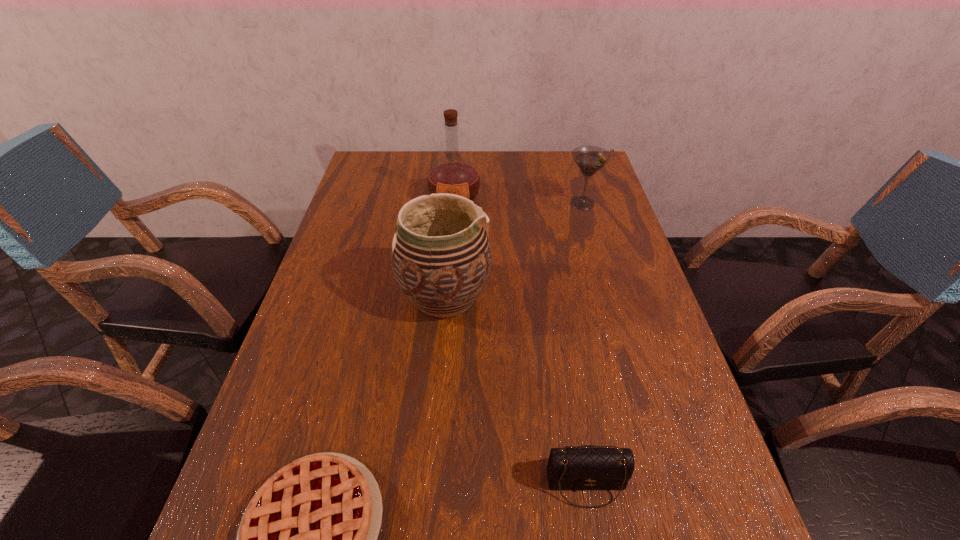
Select which object appears as the fourth closest to the third nearest object. Please provide its 2D coordinates. Your answer should be formatted as a tuple, i.e. [(x, y)], where the tuple contains the x and y coordinates of a point satisfying the conditions above.

[(590, 159)]